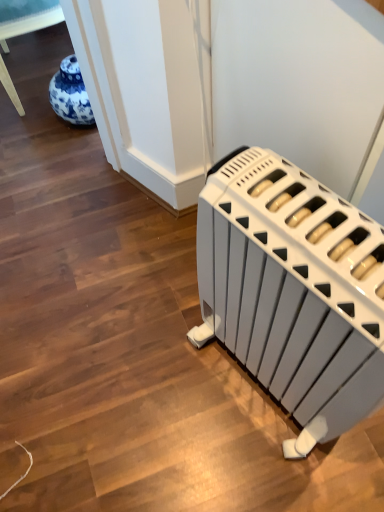
Locate an element on the screen. Image resolution: width=384 pixels, height=512 pixels. white plastic heater at lower right is located at coordinates (293, 291).

The height and width of the screenshot is (512, 384). What do you see at coordinates (293, 291) in the screenshot?
I see `white plastic heater at lower right` at bounding box center [293, 291].

Locate an element on the screen. The image size is (384, 512). white plastic heater at lower right is located at coordinates (293, 291).